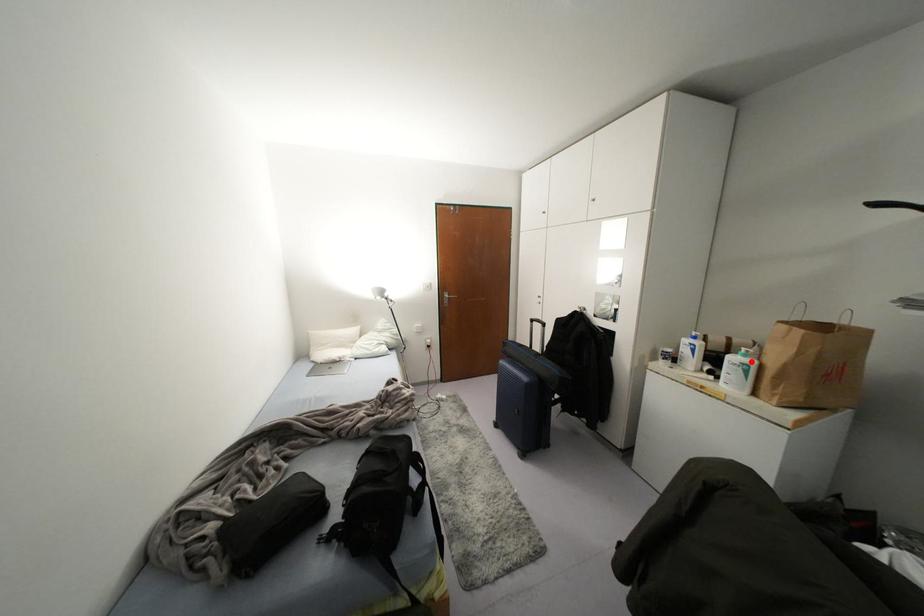
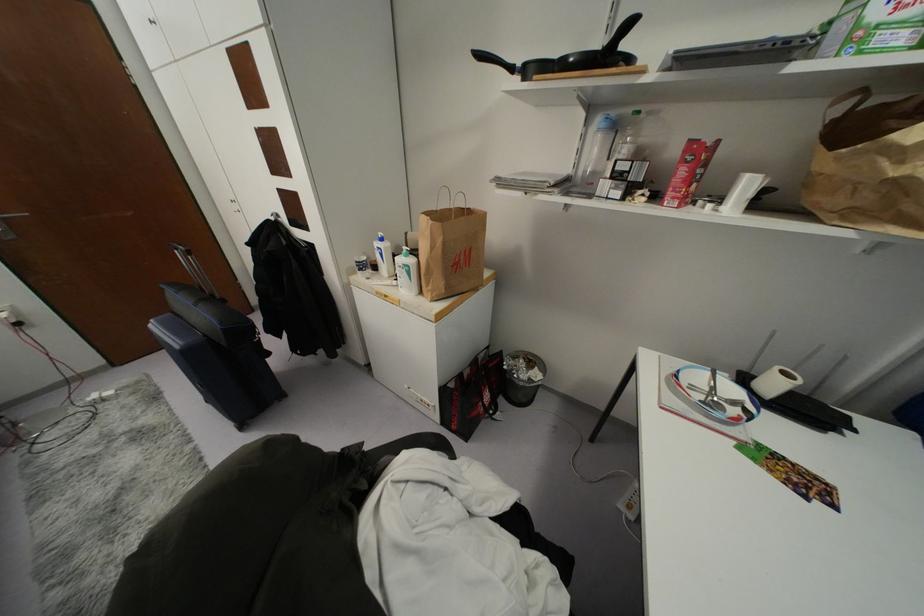
The point at the highlighted location is marked in the first image. Where is the corresponding point in the second image?

(410, 261)